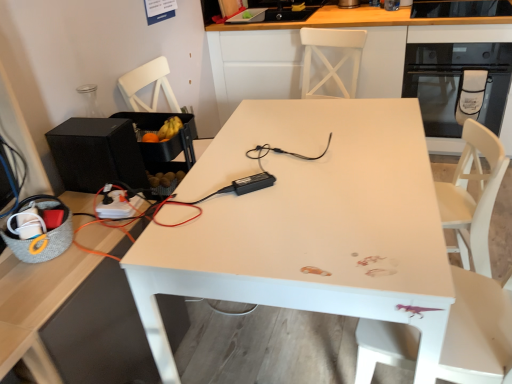
Question: Is black matte speaker at left wider than white matte table at center?

Choices:
 (A) no
 (B) yes

Answer: (A)

Question: From the image's perspective, is black matte speaker at left located beneath white matte table at center?

Choices:
 (A) no
 (B) yes

Answer: (A)

Question: Considering the relative sizes of black matte speaker at left and white matte table at center in the image provided, is black matte speaker at left smaller than white matte table at center?

Choices:
 (A) yes
 (B) no

Answer: (A)

Question: Does black matte speaker at left have a lesser height compared to white matte table at center?

Choices:
 (A) no
 (B) yes

Answer: (B)

Question: Does black matte speaker at left appear on the left side of white matte table at center?

Choices:
 (A) no
 (B) yes

Answer: (B)

Question: Do you think white glossy cabinet at upper center is within white matte table at center, or outside of it?

Choices:
 (A) outside
 (B) inside

Answer: (A)

Question: Considering their positions, is white glossy cabinet at upper center located in front of or behind white matte table at center?

Choices:
 (A) behind
 (B) front

Answer: (A)

Question: From a real-world perspective, relative to white matte table at center, is white glossy cabinet at upper center vertically above or below?

Choices:
 (A) above
 (B) below

Answer: (A)

Question: Looking at the image, does white glossy cabinet at upper center seem bigger or smaller compared to white matte table at center?

Choices:
 (A) small
 (B) big

Answer: (B)

Question: Is point 451,150 positioned closer to the camera than point 115,140?

Choices:
 (A) closer
 (B) farther

Answer: (B)

Question: Considering the positions of black glass oven at upper right and black matte speaker at left in the image, is black glass oven at upper right taller or shorter than black matte speaker at left?

Choices:
 (A) tall
 (B) short

Answer: (A)

Question: From the image's perspective, is black glass oven at upper right above or below black matte speaker at left?

Choices:
 (A) above
 (B) below

Answer: (A)

Question: From a real-world perspective, is black glass oven at upper right positioned above or below black matte speaker at left?

Choices:
 (A) below
 (B) above

Answer: (A)

Question: Is black matte speaker at left in front of or behind white glossy cabinet at upper center in the image?

Choices:
 (A) behind
 (B) front

Answer: (B)

Question: Is black matte speaker at left inside the boundaries of white glossy cabinet at upper center, or outside?

Choices:
 (A) outside
 (B) inside

Answer: (A)